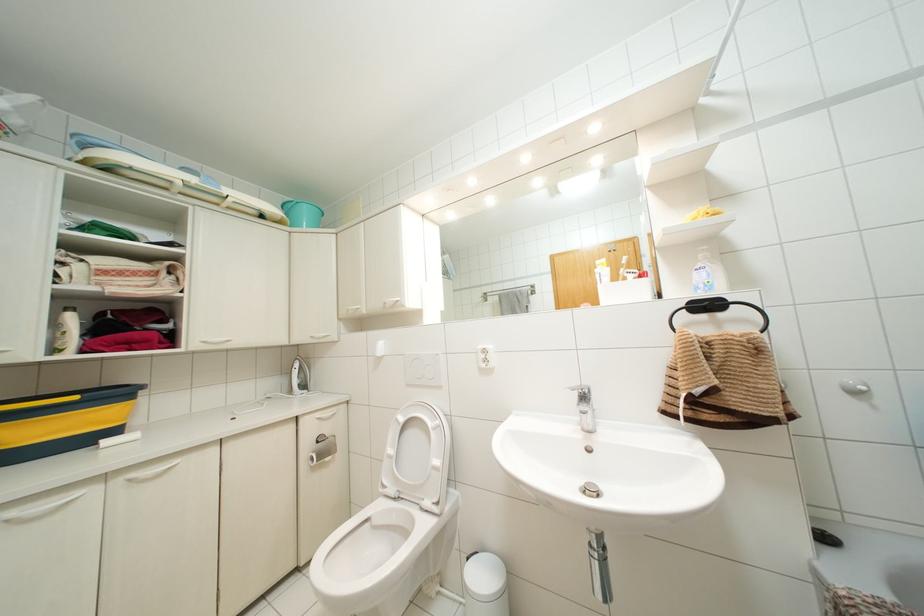
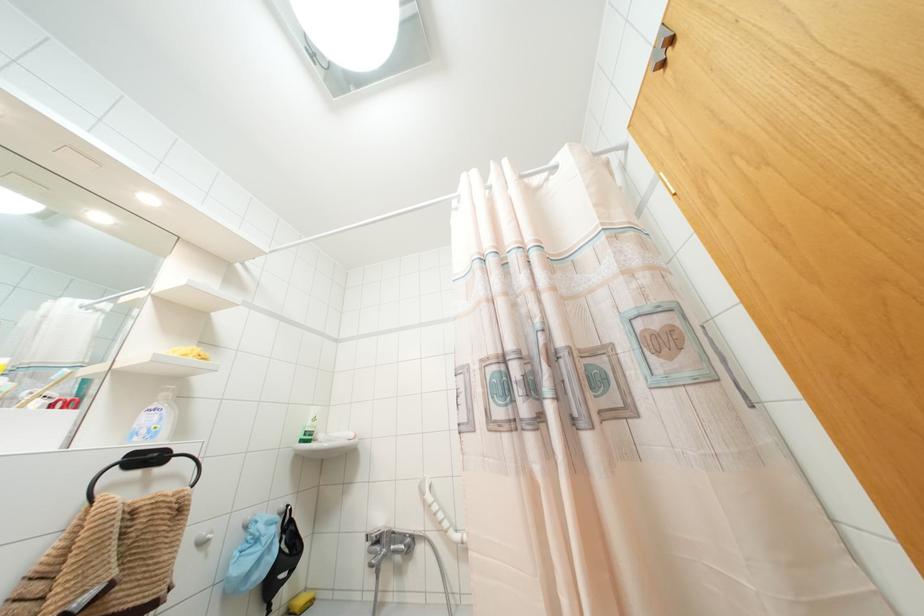
Locate, in the second image, the point that corresponds to the point at 707,305 in the first image.

(147, 458)